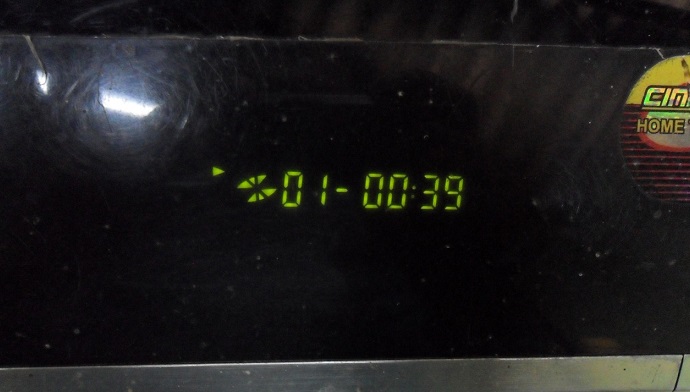
Where is `fan design`? This screenshot has width=690, height=392. fan design is located at coordinates (250, 176), (262, 194).